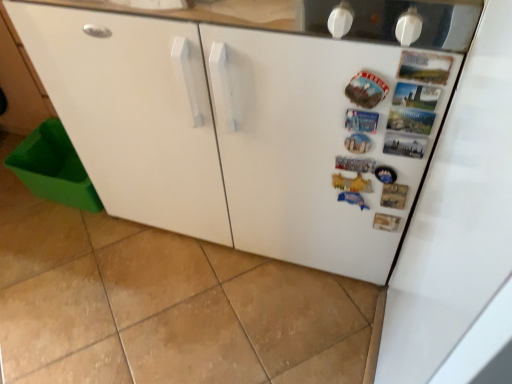
At what (x,y) coordinates should I click in order to perform the action: click on green plastic bin at lower left. Please return your answer as a coordinate pair (x, y). This screenshot has width=512, height=384. Looking at the image, I should click on (133, 113).

What do you see at coordinates (133, 113) in the screenshot?
I see `green plastic bin at lower left` at bounding box center [133, 113].

You are a GUI agent. You are given a task and a screenshot of the screen. Output one action in this format:
    pyautogui.click(x=<x>, y=<y>)
    Task: Click on the white matte refrigerator at center-right
    Image resolution: width=512 pixels, height=384 pixels.
    Given the screenshot: What is the action you would take?
    pyautogui.click(x=258, y=120)

What do you see at coordinates (258, 120) in the screenshot?
I see `white matte refrigerator at center-right` at bounding box center [258, 120].

The image size is (512, 384). I want to click on green plastic bin at lower left, so click(133, 113).

Is green plastic bin at lower left to the left of white matte refrigerator at center-right from the viewer's perspective?

Yes, green plastic bin at lower left is to the left of white matte refrigerator at center-right.

In the image, is green plastic bin at lower left positioned in front of or behind white matte refrigerator at center-right?

green plastic bin at lower left is in front of white matte refrigerator at center-right.

Considering the points (182, 163) and (166, 37), which point is in front, point (182, 163) or point (166, 37)?

The point (166, 37) is closer to the camera.

From the image's perspective, is green plastic bin at lower left on white matte refrigerator at center-right?

No, from the image's perspective, green plastic bin at lower left is not above white matte refrigerator at center-right.

From a real-world perspective, between green plastic bin at lower left and white matte refrigerator at center-right, who is vertically lower?

green plastic bin at lower left.

Is green plastic bin at lower left wider or thinner than white matte refrigerator at center-right?

green plastic bin at lower left is wider than white matte refrigerator at center-right.

Who is taller, green plastic bin at lower left or white matte refrigerator at center-right?

white matte refrigerator at center-right is taller.

Who is smaller, green plastic bin at lower left or white matte refrigerator at center-right?

Smaller between the two is white matte refrigerator at center-right.

Choose the correct answer: Is green plastic bin at lower left inside white matte refrigerator at center-right or outside it?

green plastic bin at lower left cannot be found inside white matte refrigerator at center-right.

Is green plastic bin at lower left in contact with white matte refrigerator at center-right?

Yes, green plastic bin at lower left is beside white matte refrigerator at center-right.

Is green plastic bin at lower left oriented away from white matte refrigerator at center-right?

That's not correct — green plastic bin at lower left is not looking away from white matte refrigerator at center-right.

How many degrees apart are the facing directions of green plastic bin at lower left and white matte refrigerator at center-right?

The angular difference between green plastic bin at lower left and white matte refrigerator at center-right is 1.2 degrees.

At what (x,y) coordinates should I click in order to perform the action: click on refrigerator behind the green plastic bin at lower left. Please return your answer as a coordinate pair (x, y). The height and width of the screenshot is (384, 512). Looking at the image, I should click on (258, 120).

In the scene shown: Can you confirm if white matte refrigerator at center-right is positioned to the left of green plastic bin at lower left?

Incorrect, white matte refrigerator at center-right is not on the left side of green plastic bin at lower left.

Which object is further away from the camera, white matte refrigerator at center-right or green plastic bin at lower left?

white matte refrigerator at center-right is further away from the camera.

Which point is more distant from viewer, (390, 182) or (130, 190)?

The point (130, 190) is farther.

From the image's perspective, is white matte refrigerator at center-right located above or below green plastic bin at lower left?

white matte refrigerator at center-right is situated higher than green plastic bin at lower left in the image.

From a real-world perspective, who is located lower, white matte refrigerator at center-right or green plastic bin at lower left?

green plastic bin at lower left.

Can you confirm if white matte refrigerator at center-right is thinner than green plastic bin at lower left?

Correct, the width of white matte refrigerator at center-right is less than that of green plastic bin at lower left.

Considering the sizes of white matte refrigerator at center-right and green plastic bin at lower left in the image, is white matte refrigerator at center-right taller or shorter than green plastic bin at lower left?

Considering their sizes, white matte refrigerator at center-right has more height than green plastic bin at lower left.

Does white matte refrigerator at center-right have a smaller size compared to green plastic bin at lower left?

Yes, white matte refrigerator at center-right is smaller than green plastic bin at lower left.

Do you think white matte refrigerator at center-right is within green plastic bin at lower left, or outside of it?

white matte refrigerator at center-right is not enclosed by green plastic bin at lower left.

Is there a large distance between white matte refrigerator at center-right and green plastic bin at lower left?

That's not correct — white matte refrigerator at center-right is a little close to green plastic bin at lower left.

Is white matte refrigerator at center-right aimed at green plastic bin at lower left?

No, white matte refrigerator at center-right is not facing towards green plastic bin at lower left.

What's the angular difference between white matte refrigerator at center-right and green plastic bin at lower left's facing directions?

1.2 degrees separate the facing orientations of white matte refrigerator at center-right and green plastic bin at lower left.

You are a GUI agent. You are given a task and a screenshot of the screen. Output one action in this format:
    pyautogui.click(x=<x>, y=<y>)
    Task: Click on the cabinetry on the left of white matte refrigerator at center-right
    This screenshot has width=512, height=384.
    Given the screenshot: What is the action you would take?
    pyautogui.click(x=133, y=113)

The image size is (512, 384). Find the location of `cabinetry directly beneath the white matte refrigerator at center-right (from a real-world perspective)`. cabinetry directly beneath the white matte refrigerator at center-right (from a real-world perspective) is located at coordinates (133, 113).

The image size is (512, 384). I want to click on refrigerator behind the green plastic bin at lower left, so click(258, 120).